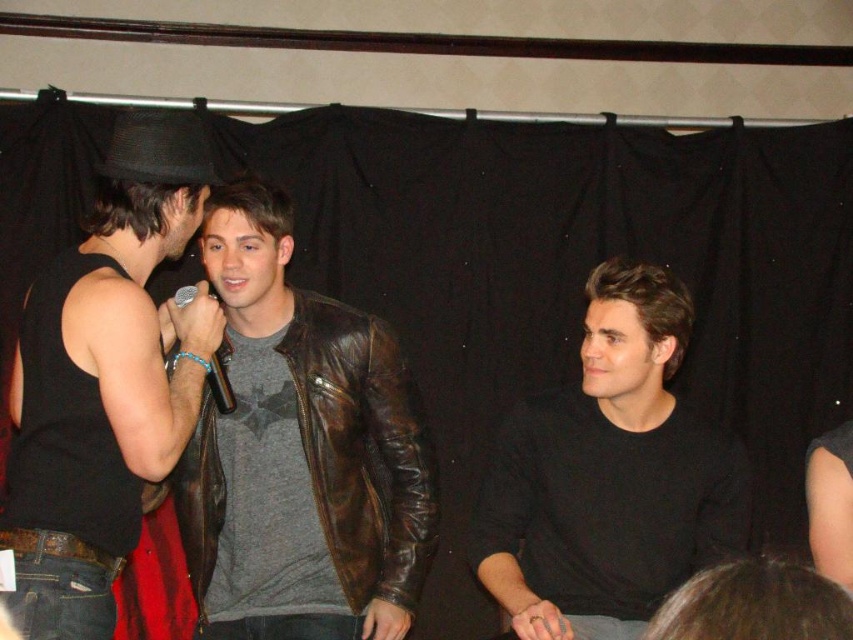
You are a stagehand setting up for a performance. You need to place a 1.2 meter tall stand between the black leather jacket at left and the metallic silver microphone at center. Will the stand fit vertically between them?

The black leather jacket at left is taller than the metallic silver microphone at center, so the 1.2 meter tall stand may not fit vertically between them if the space between is constrained by their heights.

You are a stagehand preparing to adjust the lighting for the performers. You notice the black leather jacket at left and the metallic silver microphone at center. Which object is closer to the audience? Please explain your reasoning based on their positions.

The black leather jacket at left is closer to the audience because it is positioned in front of the metallic silver microphone at center, meaning it is nearer to the front of the stage.

Based on the coordinates provided, which object in the scene is located at point [105,380]?

The point [105,380] corresponds to the black leather jacket at left.